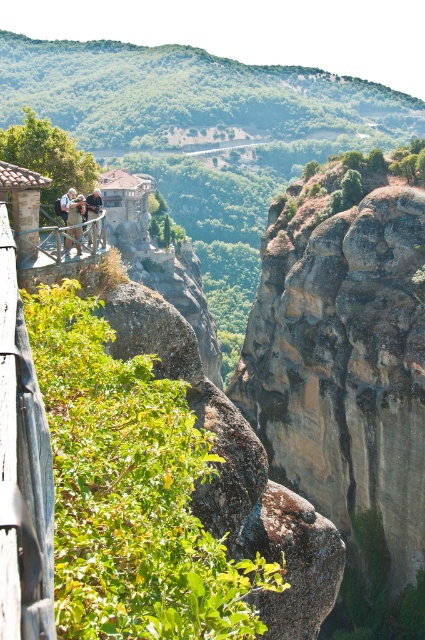
Does brown rough rock at center appear on the right side of light brown leather jacket at upper center?

Indeed, brown rough rock at center is positioned on the right side of light brown leather jacket at upper center.

Image resolution: width=425 pixels, height=640 pixels. I want to click on brown rough rock at center, so click(x=346, y=380).

What do you see at coordinates (346, 380) in the screenshot?
I see `brown rough rock at center` at bounding box center [346, 380].

Locate an element on the screen. The width and height of the screenshot is (425, 640). brown rough rock at center is located at coordinates (346, 380).

The image size is (425, 640). Describe the element at coordinates (47, 248) in the screenshot. I see `wooden at left` at that location.

Does wooden at left appear on the left side of light brown leather jacket at upper center?

No, wooden at left is not to the left of light brown leather jacket at upper center.

Locate an element on the screen. This screenshot has height=640, width=425. wooden at left is located at coordinates (47, 248).

Locate an element on the screen. wooden at left is located at coordinates (47, 248).

Is green leafy hillside at upper center in front of light brown leather jacket at upper center?

No, it is not.

Is green leafy hillside at upper center behind light brown leather jacket at upper center?

Yes, it is behind light brown leather jacket at upper center.

Identify the location of green leafy hillside at upper center. (189, 96).